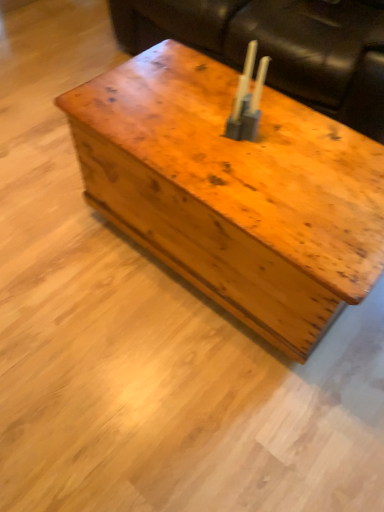
At what (x,y) coordinates should I click in order to perform the action: click on free space on the front side of wooden trunk at center. Please return your answer as a coordinate pair (x, y). Image resolution: width=384 pixels, height=512 pixels. Looking at the image, I should click on (195, 399).